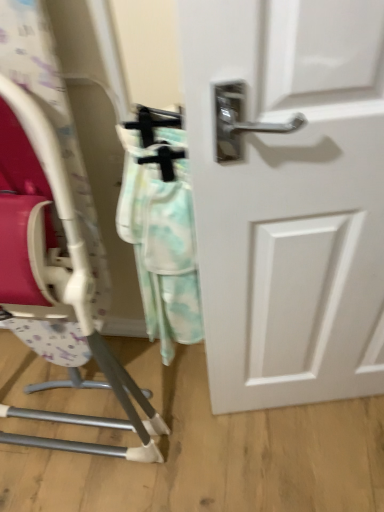
I want to click on white glossy door handle at center, so click(x=288, y=196).

Image resolution: width=384 pixels, height=512 pixels. Describe the element at coordinates (288, 196) in the screenshot. I see `white glossy door handle at center` at that location.

The image size is (384, 512). What are the coordinates of `white glossy door handle at center` in the screenshot? It's located at (288, 196).